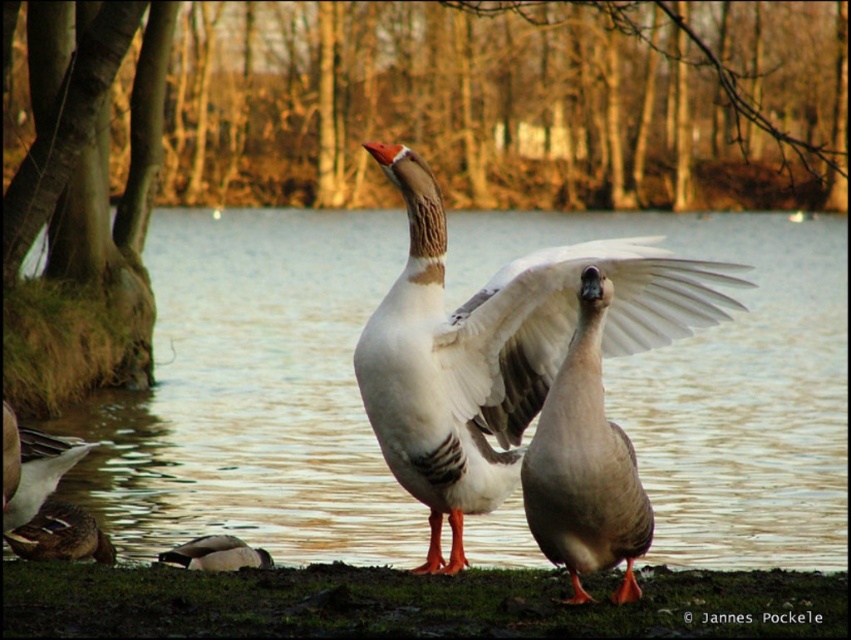
Question: Which point is farther to the camera?

Choices:
 (A) (500, 424)
 (B) (186, 467)
 (C) (570, 481)

Answer: (B)

Question: Based on their relative distances, which object is farther from the matte gray duck at center?

Choices:
 (A) white feathered wing at center
 (B) brown matte duck at lower left
 (C) brown fuzzy duck at lower left
 (D) brown feathered duck at lower left

Answer: (C)

Question: Can you confirm if white feathered wing at center is positioned to the right of brown matte duck at lower left?

Choices:
 (A) no
 (B) yes

Answer: (B)

Question: Does white feathered goose at center have a greater width compared to white feathered wing at center?

Choices:
 (A) no
 (B) yes

Answer: (B)

Question: Does brown fuzzy duck at lower left have a lesser width compared to brown matte duck at lower left?

Choices:
 (A) no
 (B) yes

Answer: (B)

Question: Which point is closer to the camera taking this photo?

Choices:
 (A) (566, 344)
 (B) (604, 422)
 (C) (216, 566)

Answer: (B)